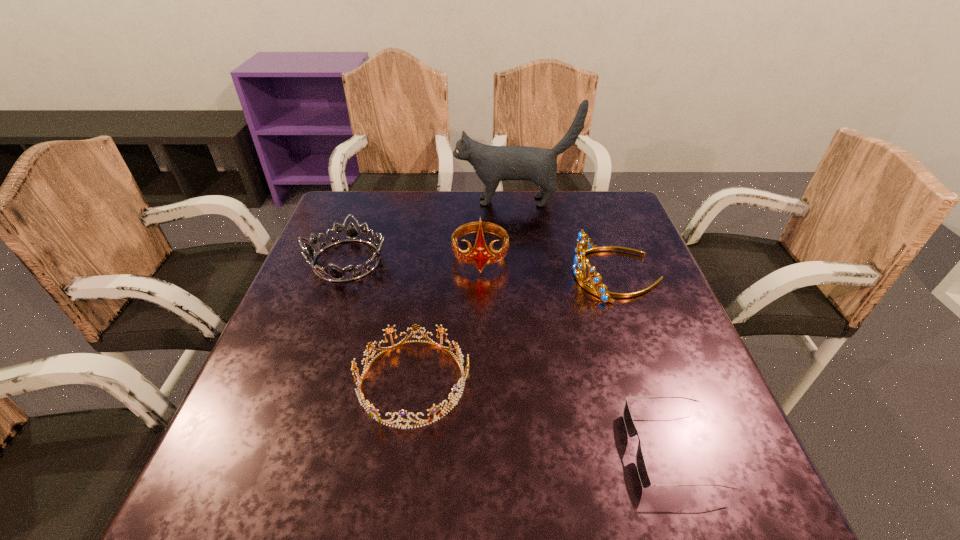
The width and height of the screenshot is (960, 540). Identify the location of vacant position at the far left corner of the desktop. (341, 224).

The width and height of the screenshot is (960, 540). I want to click on free space between the tallest object and the nearest tiara, so click(x=464, y=291).

Where is `unoccupied position between the shortest object and the nearest tiara`? The width and height of the screenshot is (960, 540). unoccupied position between the shortest object and the nearest tiara is located at coordinates (542, 415).

At what (x,y) coordinates should I click in order to perform the action: click on empty space between the shortest object and the cat. Please return your answer as a coordinate pair (x, y). Looking at the image, I should click on (593, 326).

Where is `vacant area that lies between the farthest object and the nearest tiara`? The image size is (960, 540). vacant area that lies between the farthest object and the nearest tiara is located at coordinates (464, 291).

Identify the location of empty space between the rightmost tiara and the nearest tiara. The width and height of the screenshot is (960, 540). (515, 328).

Identify which object is the fourth nearest to the tallest tiara. Please provide its 2D coordinates. Your answer should be formatted as a tuple, i.e. [(x, y)], where the tuple contains the x and y coordinates of a point satisfying the conditions above.

[(371, 409)]

Where is `object that is the nearest to the tallest tiara`? This screenshot has height=540, width=960. object that is the nearest to the tallest tiara is located at coordinates (583, 239).

Identify which tiara is the second closest to the nearest tiara. Please provide its 2D coordinates. Your answer should be formatted as a tuple, i.e. [(x, y)], where the tuple contains the x and y coordinates of a point satisfying the conditions above.

[(480, 255)]

Locate which tiara is the second closest to the third shortest tiara. Please provide its 2D coordinates. Your answer should be formatted as a tuple, i.e. [(x, y)], where the tuple contains the x and y coordinates of a point satisfying the conditions above.

[(371, 409)]